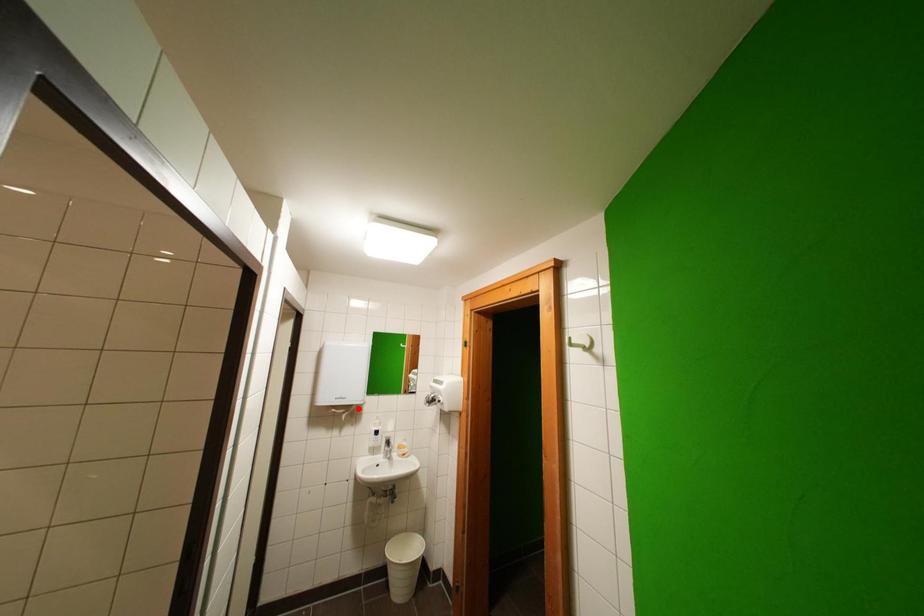
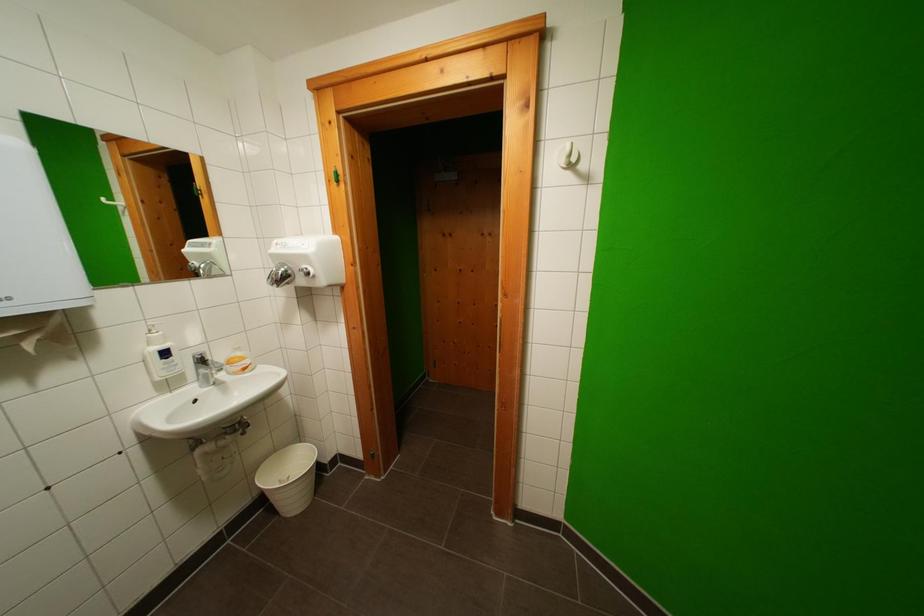
Where in the second image is the point corresponding to the highlighted location from the first image?

(55, 317)